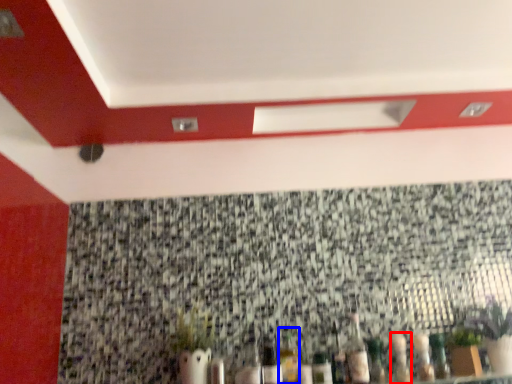
Question: Among these objects, which one is farthest to the camera, bottle (highlighted by a red box) or bottle (highlighted by a blue box)?

Choices:
 (A) bottle
 (B) bottle

Answer: (B)